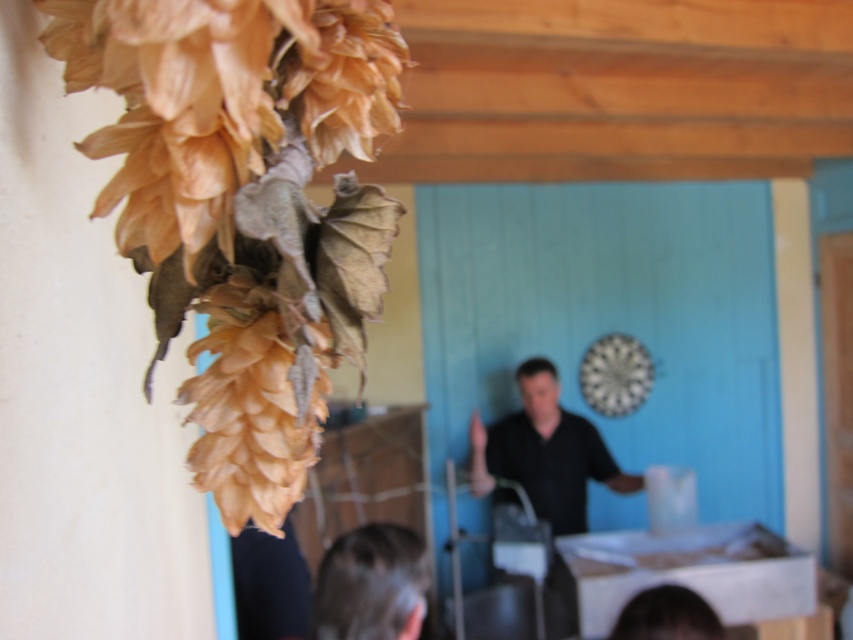
Question: Based on their relative distances, which object is nearer to the dark brown hair at lower center?

Choices:
 (A) matte black shirt at center
 (B) white cardboard box at lower center

Answer: (B)

Question: Can you confirm if white cardboard box at lower center is wider than dark brown hair at lower center?

Choices:
 (A) no
 (B) yes

Answer: (B)

Question: Can you confirm if dark brown hair at lower center is bigger than matte black shirt at center?

Choices:
 (A) no
 (B) yes

Answer: (B)

Question: Which of the following is the farthest from the observer?

Choices:
 (A) (363, 536)
 (B) (705, 544)

Answer: (B)

Question: Which object appears farthest from the camera in this image?

Choices:
 (A) matte black shirt at center
 (B) white cardboard box at lower center
 (C) dark brown hair at lower center

Answer: (A)

Question: Can you confirm if white cardboard box at lower center is positioned below matte black shirt at center?

Choices:
 (A) no
 (B) yes

Answer: (B)